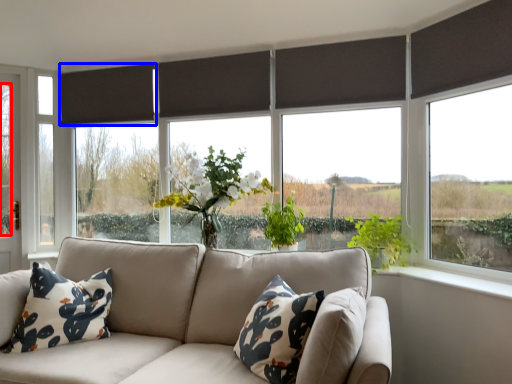
Question: Which of the following is the farthest to the observer, tree (highlighted by a red box) or curtain (highlighted by a blue box)?

Choices:
 (A) tree
 (B) curtain

Answer: (A)